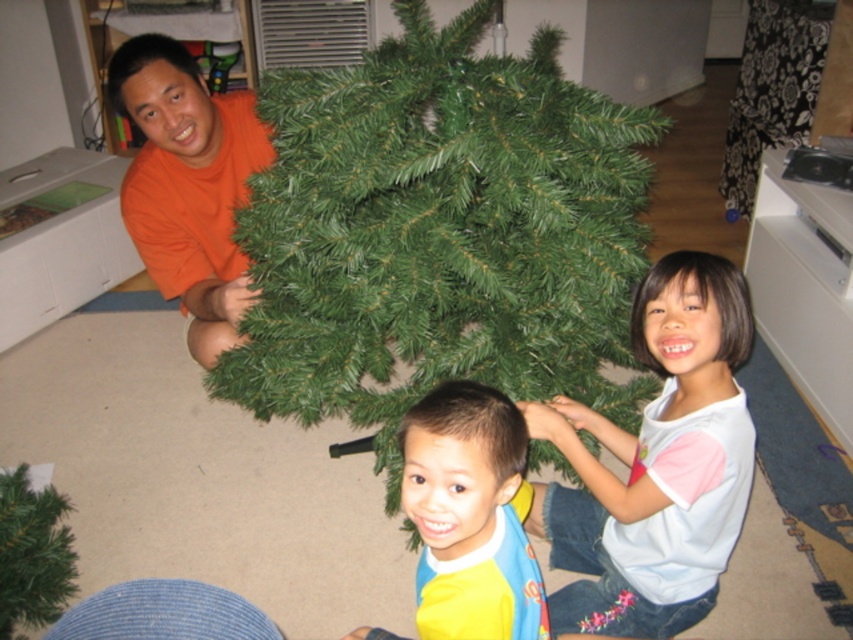
You are a photographer standing in front of the Christmas tree. You want to take a photo of the orange matte shirt at left and the yellow fabric bib at center. Which object will appear larger in the photo?

The orange matte shirt at left will appear larger in the photo because it is closer to the photographer than the yellow fabric bib at center.

You are standing in the living room and want to place a 4.5 feet tall decoration on the green artificial christmas tree at center. Can you reach the top of the tree to place it?

The green artificial christmas tree at center is 4.36 feet away from the viewer, so the decoration is 4.5 feet tall. Since the decoration is taller than the tree, it won

Looking at this image, you are a photographer trying to capture a group photo of the orange matte shirt at left and the yellow fabric bib at center. Since you want everyone to be visible, you need to adjust your camera angle. Which object should you focus on first to ensure both are in frame?

The orange matte shirt at left is taller than the yellow fabric bib at center, so you should focus on the orange matte shirt at left first to ensure both are in frame.